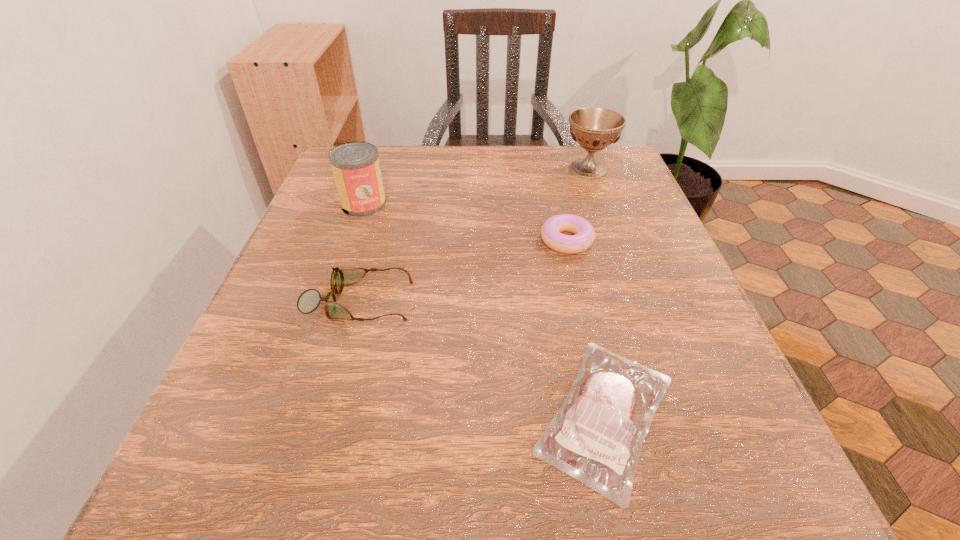
At what (x,y) coordinates should I click in order to perform the action: click on the third closest object relative to the third farthest object. Please return your answer as a coordinate pair (x, y). This screenshot has width=960, height=540. Looking at the image, I should click on (309, 300).

Where is `object that can be found as the third closest to the second shortest object`? object that can be found as the third closest to the second shortest object is located at coordinates (309, 300).

You are a GUI agent. You are given a task and a screenshot of the screen. Output one action in this format:
    pyautogui.click(x=<x>, y=<y>)
    Task: Click on the vacant space that satisfies the following two spatial constraints: 1. on the front-facing side of the nearest object; 2. on the left side of the spectacles
    
    Given the screenshot: What is the action you would take?
    pyautogui.click(x=328, y=415)

The height and width of the screenshot is (540, 960). I want to click on vacant point that satisfies the following two spatial constraints: 1. on the front-facing side of the steak; 2. on the left side of the spectacles, so click(328, 415).

Identify the location of free space in the image that satisfies the following two spatial constraints: 1. on the back side of the farthest object; 2. on the right side of the third farthest object. (x=550, y=169).

The width and height of the screenshot is (960, 540). Find the location of `vacant space that satisfies the following two spatial constraints: 1. on the front-facing side of the spectacles; 2. on the back side of the nearest object`. vacant space that satisfies the following two spatial constraints: 1. on the front-facing side of the spectacles; 2. on the back side of the nearest object is located at coordinates (x=328, y=415).